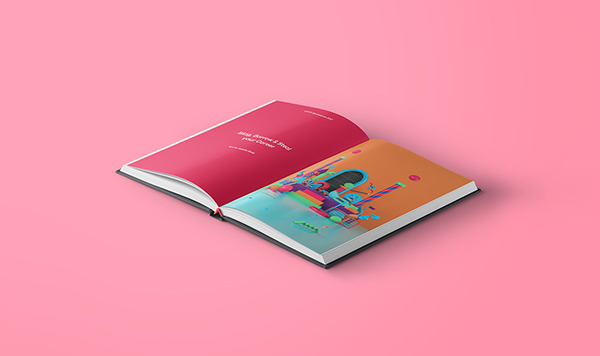
This screenshot has width=600, height=356. Identify the location of book. (315, 138).